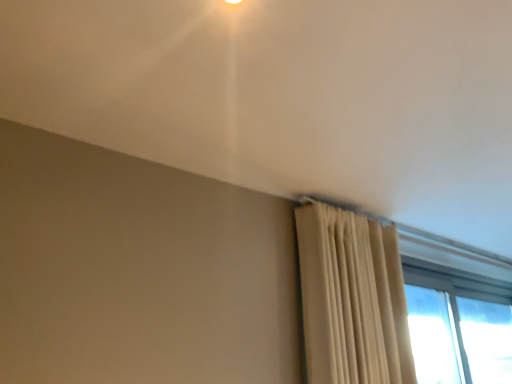
Where is `transparent glass window at right`? transparent glass window at right is located at coordinates click(458, 328).

What is the approximate width of transparent glass window at right?

transparent glass window at right is 0.78 inches wide.

The height and width of the screenshot is (384, 512). Describe the element at coordinates (458, 328) in the screenshot. I see `transparent glass window at right` at that location.

The height and width of the screenshot is (384, 512). Identify the location of transparent glass window at right. (458, 328).